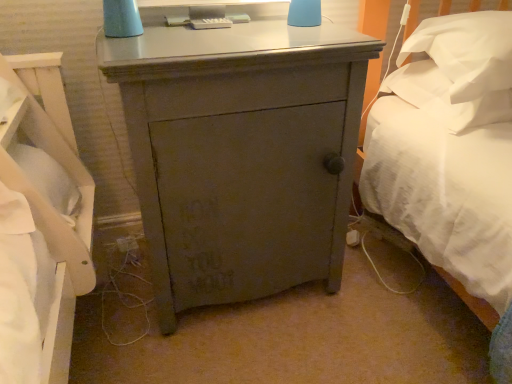
Question: Relative to matte gray cabinet at center, is white soft pillow at right, the second pillow positioned from the top, in front or behind?

Choices:
 (A) behind
 (B) front

Answer: (A)

Question: From their relative heights in the image, would you say white soft pillow at right, the second pillow positioned from the top, is taller or shorter than matte gray cabinet at center?

Choices:
 (A) tall
 (B) short

Answer: (B)

Question: Estimate the real-world distances between objects in this image. Which object is closer to the white soft pillow at right, the second pillow positioned from the top?

Choices:
 (A) white soft pillow at upper right, the 2th pillow ordered from the bottom
 (B) matte gray cabinet at center

Answer: (A)

Question: Which object is positioned farthest from the matte gray cabinet at center?

Choices:
 (A) white soft pillow at upper right, which is counted as the 1th pillow, starting from the top
 (B) white soft pillow at right, the second pillow positioned from the top

Answer: (B)